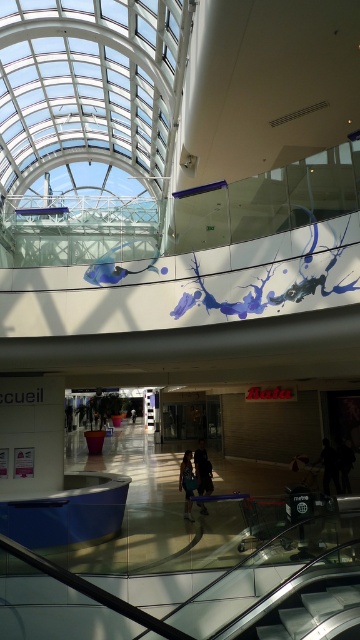
Looking at this image, who is more forward, (204,488) or (180,488)?

Point (204,488) is more forward.

Which is in front, point (194, 452) or point (189, 472)?

Positioned in front is point (189, 472).

Locate an element on the screen. The image size is (360, 640). dark blue jeans at center is located at coordinates (203, 468).